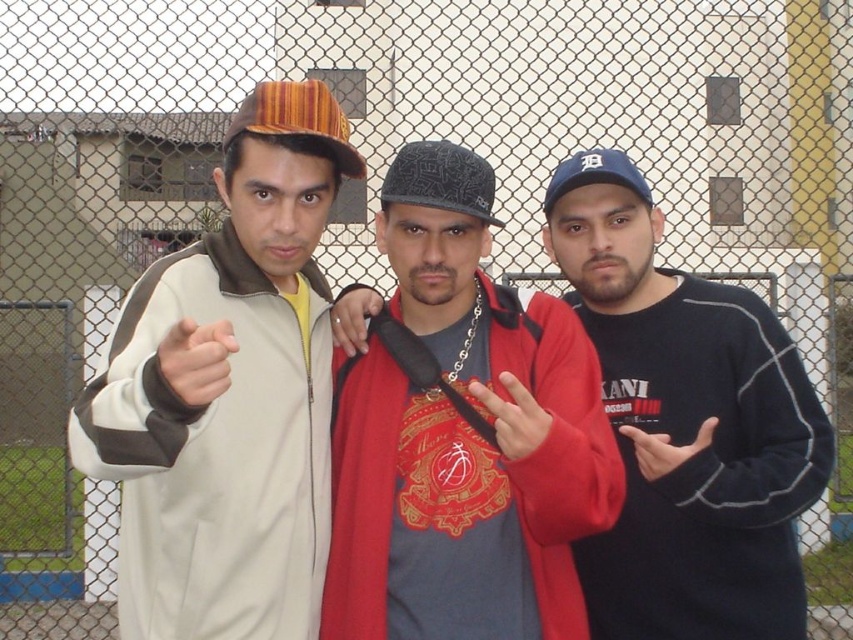
Question: Considering the relative positions of red matte jacket at center and black matte sweatshirt at center in the image provided, where is red matte jacket at center located with respect to black matte sweatshirt at center?

Choices:
 (A) right
 (B) left

Answer: (B)

Question: Is blue fabric baseball cap at center above matte black chain at center?

Choices:
 (A) yes
 (B) no

Answer: (A)

Question: Based on their relative distances, which object is farther from the black matte hand at center?

Choices:
 (A) blue fabric baseball cap at center
 (B) matte red hand at center
 (C) striped fabric baseball cap at left

Answer: (C)

Question: Can you confirm if patterned fabric baseball cap at center is wider than striped fabric baseball cap at left?

Choices:
 (A) yes
 (B) no

Answer: (B)

Question: Which object is closer to the camera taking this photo?

Choices:
 (A) matte black chain at center
 (B) matte skin hand at center
 (C) matte beige jacket at left
 (D) patterned fabric baseball cap at center

Answer: (C)

Question: Which point appears closest to the camera in this image?

Choices:
 (A) (335, 324)
 (B) (671, 445)

Answer: (B)